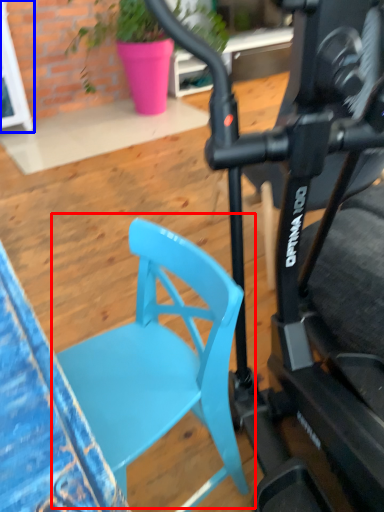
Question: Among these objects, which one is nearest to the camera, chair (highlighted by a red box) or glass door (highlighted by a blue box)?

Choices:
 (A) chair
 (B) glass door

Answer: (A)